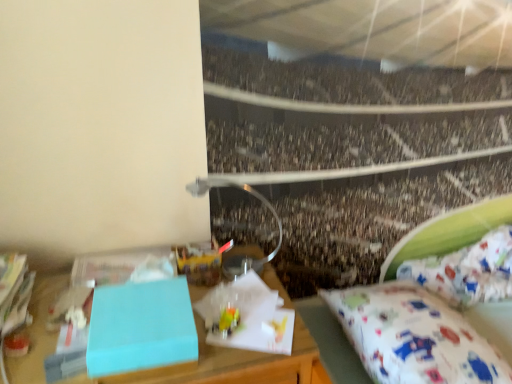
Identify the location of matte blue box at center. (249, 364).

What is the approximate width of speckled concrete crowd at center?

4.39 centimeters.

The image size is (512, 384). I want to click on light blue matte box at left, so click(141, 327).

The width and height of the screenshot is (512, 384). Identify the location of matte blue box at center. (249, 364).

From a real-world perspective, which object stands above the other?

light blue matte box at left, from a real-world perspective.

Does point (412, 86) lie behind point (98, 354)?

Yes, point (412, 86) is behind point (98, 354).

Who is taller, white fabric mattress at lower right or matte blue box at center?

Standing taller between the two is matte blue box at center.

Considering their positions, is white fabric mattress at lower right located in front of or behind matte blue box at center?

In the image, white fabric mattress at lower right appears behind matte blue box at center.

Who is bigger, white fabric mattress at lower right or matte blue box at center?

With larger size is matte blue box at center.

Is white fabric mattress at lower right oriented towards matte blue box at center?

No, white fabric mattress at lower right is not turned towards matte blue box at center.

Between speckled concrete crowd at center and white fabric mattress at lower right, which one has smaller size?

white fabric mattress at lower right.

Is speckled concrete crowd at center located outside white fabric mattress at lower right?

Yes, speckled concrete crowd at center is located beyond the bounds of white fabric mattress at lower right.

Which object is more forward, speckled concrete crowd at center or white fabric mattress at lower right?

white fabric mattress at lower right is in front.

Is light blue matte box at left at the back of matte blue box at center?

No, matte blue box at center is not facing away from light blue matte box at left.

Based on their sizes in the image, would you say matte blue box at center is bigger or smaller than light blue matte box at left?

matte blue box at center is bigger than light blue matte box at left.

Is matte blue box at center inside or outside of light blue matte box at left?

matte blue box at center is not inside light blue matte box at left, it's outside.

From the image's perspective, is matte blue box at center located above or below light blue matte box at left?

matte blue box at center is situated lower than light blue matte box at left in the image.

Which object is positioned more to the left, light blue matte box at left or white fabric mattress at lower right?

light blue matte box at left is more to the left.

From a real-world perspective, relative to white fabric mattress at lower right, is light blue matte box at left vertically above or below?

From a real-world perspective, light blue matte box at left is physically above white fabric mattress at lower right.

Considering the relative sizes of light blue matte box at left and white fabric mattress at lower right in the image provided, is light blue matte box at left bigger than white fabric mattress at lower right?

Actually, light blue matte box at left might be smaller than white fabric mattress at lower right.

From the image's perspective, which one is positioned lower, light blue matte box at left or white fabric mattress at lower right?

white fabric mattress at lower right.

How distant is speckled concrete crowd at center from matte blue box at center?

29.48 inches.

Is speckled concrete crowd at center looking in the opposite direction of matte blue box at center?

speckled concrete crowd at center does not have its back to matte blue box at center.

Does point (342, 154) appear closer or farther from the camera than point (37, 317)?

Point (342, 154).

Based on the photo, is speckled concrete crowd at center in contact with matte blue box at center?

speckled concrete crowd at center is not next to matte blue box at center, and they're not touching.

Is matte blue box at center oriented towards white fabric mattress at lower right?

No, matte blue box at center does not turn towards white fabric mattress at lower right.

From the image's perspective, is matte blue box at center below white fabric mattress at lower right?

Yes, from the image's perspective, matte blue box at center is below white fabric mattress at lower right.

In the scene shown: Which point is more forward, (287, 306) or (379, 339)?

The point (379, 339) is in front.

How many degrees apart are the facing directions of matte blue box at center and white fabric mattress at lower right?

They differ by 3.23 degrees in their facing directions.

Identify the location of crowd on the right of light blue matte box at left. (341, 137).

The image size is (512, 384). In order to click on desk located in front of the white fabric mattress at lower right in this screenshot , I will do `click(249, 364)`.

Estimate the real-world distances between objects in this image. Which object is further from speckled concrete crowd at center, white fabric mattress at lower right or light blue matte box at left?

Among the two, light blue matte box at left is located further to speckled concrete crowd at center.

Estimate the real-world distances between objects in this image. Which object is further from metallic silver lamp at upper center, white fabric mattress at lower right or speckled concrete crowd at center?

The object further to metallic silver lamp at upper center is white fabric mattress at lower right.

Based on their spatial positions, is white fabric mattress at lower right or metallic silver lamp at upper center further from matte blue box at center?

white fabric mattress at lower right lies further to matte blue box at center than the other object.

Looking at this image, looking at the image, which one is located closer to white fabric mattress at lower right, matte blue box at center or speckled concrete crowd at center?

Among the two, matte blue box at center is located nearer to white fabric mattress at lower right.

Based on their spatial positions, is matte blue box at center or white fabric mattress at lower right further from light blue matte box at left?

white fabric mattress at lower right is further to light blue matte box at left.

From the image, which object appears to be nearer to matte blue box at center, speckled concrete crowd at center or white fabric mattress at lower right?

white fabric mattress at lower right lies closer to matte blue box at center than the other object.

Looking at the image, which one is located closer to metallic silver lamp at upper center, matte blue box at center or white fabric mattress at lower right?

matte blue box at center is positioned closer to the anchor metallic silver lamp at upper center.

When comparing their distances from metallic silver lamp at upper center, does light blue matte box at left or white fabric mattress at lower right seem closer?

light blue matte box at left is positioned closer to the anchor metallic silver lamp at upper center.

Where is `box between matte blue box at center and white fabric mattress at lower right`? The width and height of the screenshot is (512, 384). box between matte blue box at center and white fabric mattress at lower right is located at coordinates (141, 327).

You are a GUI agent. You are given a task and a screenshot of the screen. Output one action in this format:
    pyautogui.click(x=<x>, y=<y>)
    Task: Click on the lamp located between light blue matte box at left and white fabric mattress at lower right in the left-right direction
    The width and height of the screenshot is (512, 384).
    Given the screenshot: What is the action you would take?
    pyautogui.click(x=238, y=255)

Locate an element on the screen. lamp situated between matte blue box at center and white fabric mattress at lower right from left to right is located at coordinates (238, 255).

Where is `lamp located between light blue matte box at left and speckled concrete crowd at center in the left-right direction`? The height and width of the screenshot is (384, 512). lamp located between light blue matte box at left and speckled concrete crowd at center in the left-right direction is located at coordinates (238, 255).